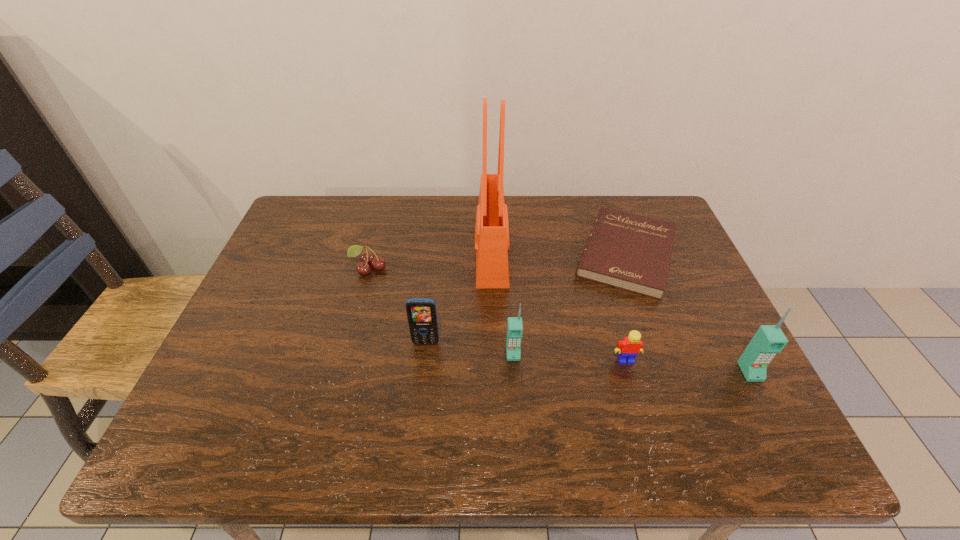
Locate an element on the screen. The width and height of the screenshot is (960, 540). free space between the nearest cellular telephone and the leftmost cellular telephone is located at coordinates (588, 357).

The height and width of the screenshot is (540, 960). In order to click on unoccupied area between the leftmost object and the tallest object in this screenshot , I will do `click(430, 261)`.

Locate an element on the screen. free spot between the leftmost cellular telephone and the second cellular telephone from right to left is located at coordinates (469, 348).

Locate an element on the screen. This screenshot has width=960, height=540. vacant area between the second cellular telephone from left to right and the tallest object is located at coordinates (502, 304).

This screenshot has width=960, height=540. Identify the location of free space between the sixth tallest object and the tallest object. (430, 261).

Locate an element on the screen. The image size is (960, 540). free space between the shortest object and the second object from left to right is located at coordinates (526, 298).

At what (x,y) coordinates should I click in order to perform the action: click on free space between the third shortest object and the second tallest object. Please return your answer as a coordinate pair (x, y). The height and width of the screenshot is (540, 960). Looking at the image, I should click on (688, 366).

Find the location of a particular element. The image size is (960, 540). unoccupied position between the tote bag and the hardback book is located at coordinates (559, 254).

Image resolution: width=960 pixels, height=540 pixels. What are the coordinates of `free space between the tallest cellular telephone and the hardback book` in the screenshot? It's located at (688, 313).

Select which object is the fourth closest to the second cellular telephone from left to right. Please provide its 2D coordinates. Your answer should be formatted as a tuple, i.e. [(x, y)], where the tuple contains the x and y coordinates of a point satisfying the conditions above.

[(631, 252)]